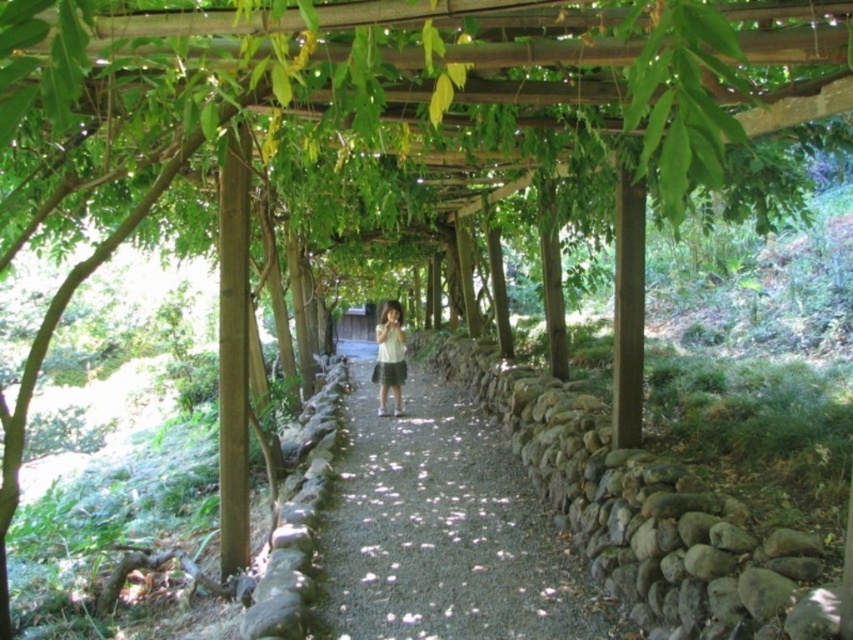
Question: Can you confirm if gravel path at center is smaller than white matte shirt at center?

Choices:
 (A) no
 (B) yes

Answer: (B)

Question: Does gravel path at center appear over white matte shirt at center?

Choices:
 (A) yes
 (B) no

Answer: (B)

Question: Which point is farther to the camera?

Choices:
 (A) (335, 568)
 (B) (381, 397)

Answer: (B)

Question: Is the position of gravel path at center less distant than that of white matte shirt at center?

Choices:
 (A) no
 (B) yes

Answer: (B)